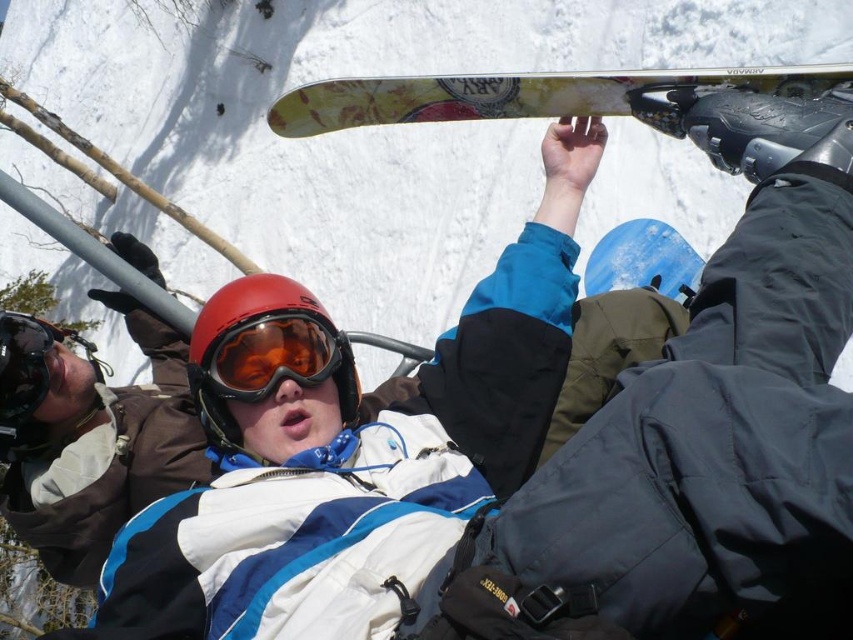
Question: Can you confirm if blue matte snowboard at center is wider than matte black goggles at upper center?

Choices:
 (A) yes
 (B) no

Answer: (A)

Question: Is matte orange ski goggles at center to the right of matte black goggles at upper center from the viewer's perspective?

Choices:
 (A) no
 (B) yes

Answer: (B)

Question: Estimate the real-world distances between objects in this image. Which object is farther from the blue matte snowboard at center?

Choices:
 (A) matte orange ski goggles at center
 (B) white matte jacket at center

Answer: (A)

Question: Which point is farther to the camera?

Choices:
 (A) (397, 106)
 (B) (630, 275)
 (C) (195, 538)

Answer: (B)

Question: Which of the following is the closest to the observer?

Choices:
 (A) (693, 436)
 (B) (550, 108)

Answer: (A)

Question: From the image, what is the correct spatial relationship of yellowish wood snowboard at upper center in relation to matte black goggles at upper center?

Choices:
 (A) above
 (B) below

Answer: (A)